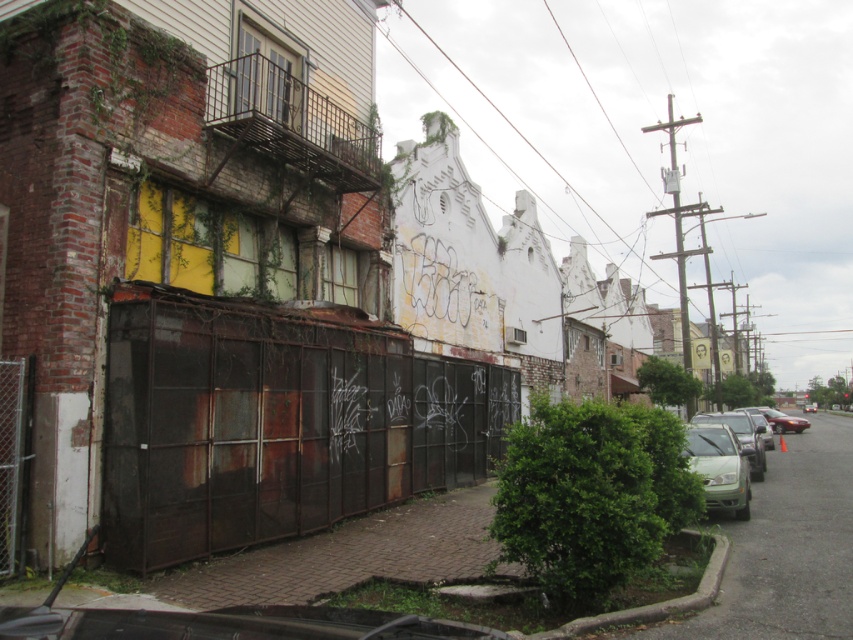
You are standing in the urban street scene described. There are two points marked as point 1 at coordinates (285, 433) and point 2 at coordinates (698, 445). Which point is closer to you?

Point 1 at coordinates (285, 433) is closer to you because it is in front of point 2 at coordinates (698, 445).